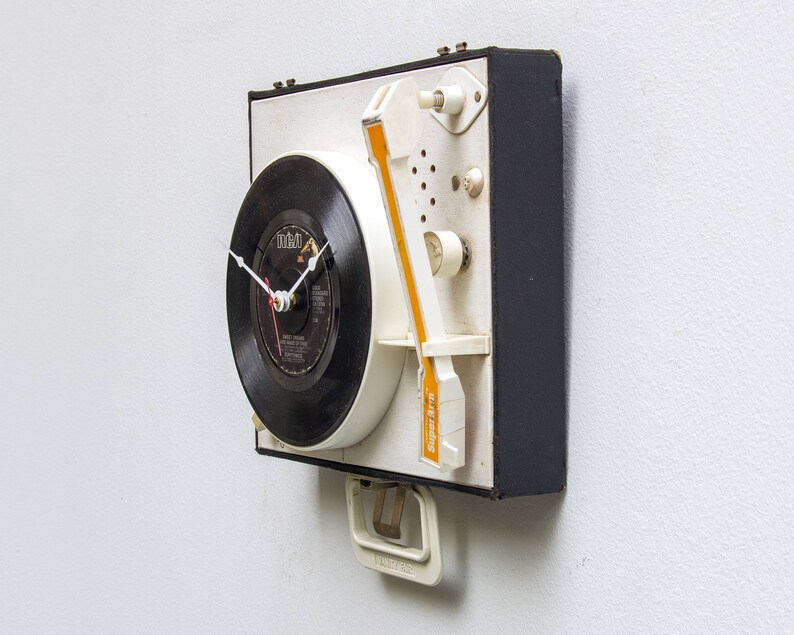
In order to click on record player in this screenshot , I will do `click(326, 110)`.